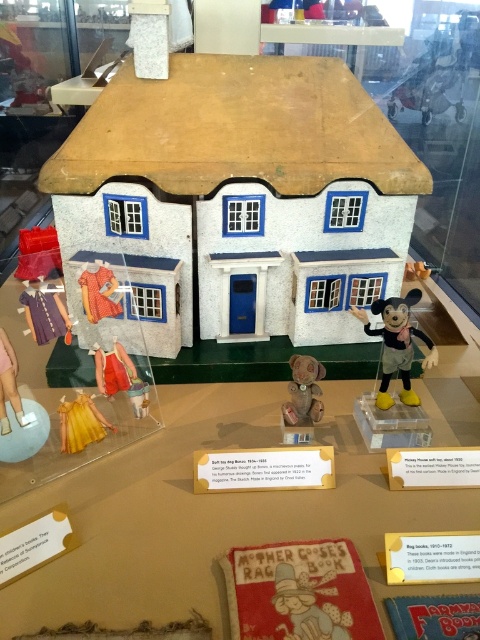
You are a museum visitor who wants to take a photo of the matte brown plush bear at center and the yellow satin dress at lower left. Which object should you focus on first if you want to capture both in one frame without moving the camera?

You should focus on the matte brown plush bear at center first because it is smaller in size compared to the yellow satin dress at lower left, allowing you to fit both into the frame by adjusting the zoom accordingly.

You are a visitor at the museum exhibit of the miniature house. You see a point at coordinate (396, 344). Where is this point located?

The point at coordinate (396, 344) is on the matte plastic mickey mouse at right.

You are a museum visitor who wants to take a photo of the matte brown plush bear at center and the yellow satin dress at lower left. Based on their positions, where should you stand to capture both items in the frame without moving them?

You should stand in a position where you can look down at both items since the matte brown plush bear at center is located above the yellow satin dress at lower left, allowing them to be captured in the same frame from an elevated angle.